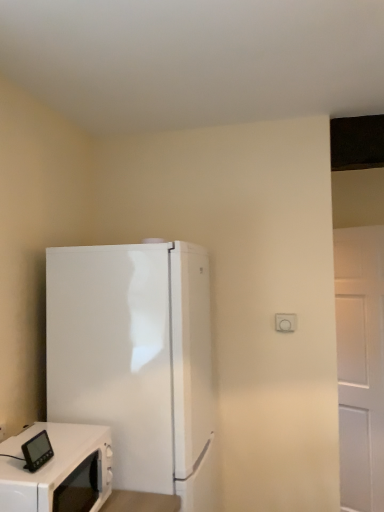
Question: From a real-world perspective, does white glossy microwave at lower left sit lower than white glossy refrigerator at left?

Choices:
 (A) yes
 (B) no

Answer: (A)

Question: Considering the relative sizes of white glossy microwave at lower left and white glossy refrigerator at left in the image provided, is white glossy microwave at lower left thinner than white glossy refrigerator at left?

Choices:
 (A) no
 (B) yes

Answer: (B)

Question: Is there a large distance between white glossy microwave at lower left and white glossy refrigerator at left?

Choices:
 (A) no
 (B) yes

Answer: (A)

Question: Can you confirm if white glossy microwave at lower left is smaller than white glossy refrigerator at left?

Choices:
 (A) no
 (B) yes

Answer: (B)

Question: Does white glossy microwave at lower left have a larger size compared to white glossy refrigerator at left?

Choices:
 (A) no
 (B) yes

Answer: (A)

Question: Is the depth of white glossy microwave at lower left less than that of white glossy refrigerator at left?

Choices:
 (A) no
 (B) yes

Answer: (B)

Question: Is white glossy refrigerator at left to the left of white glossy microwave at lower left from the viewer's perspective?

Choices:
 (A) yes
 (B) no

Answer: (B)

Question: Is the depth of white glossy refrigerator at left greater than that of white glossy microwave at lower left?

Choices:
 (A) yes
 (B) no

Answer: (A)

Question: Can you confirm if white glossy refrigerator at left is taller than white glossy microwave at lower left?

Choices:
 (A) yes
 (B) no

Answer: (A)

Question: Considering the relative sizes of white glossy refrigerator at left and white glossy microwave at lower left in the image provided, is white glossy refrigerator at left shorter than white glossy microwave at lower left?

Choices:
 (A) yes
 (B) no

Answer: (B)

Question: Is white glossy refrigerator at left oriented towards white glossy microwave at lower left?

Choices:
 (A) no
 (B) yes

Answer: (A)

Question: From a real-world perspective, is white glossy refrigerator at left positioned over white glossy microwave at lower left based on gravity?

Choices:
 (A) no
 (B) yes

Answer: (B)

Question: From the image's perspective, is white glossy microwave at lower left located above or below white glossy refrigerator at left?

Choices:
 (A) below
 (B) above

Answer: (A)